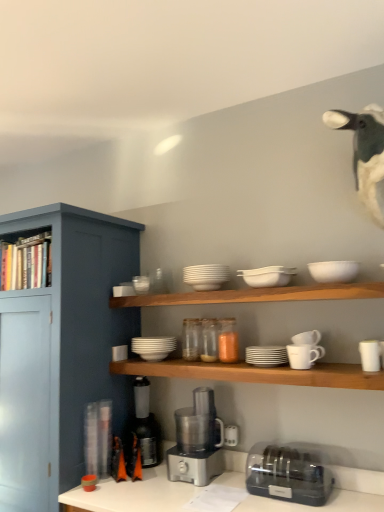
Question: From a real-world perspective, is metallic silver coffee machine at lower center, marked as the 1th coffee machine in a left-to-right arrangement, physically below satin silver food processor at center, the 1th coffee machine from the right?

Choices:
 (A) no
 (B) yes

Answer: (A)

Question: Can you confirm if metallic silver coffee machine at lower center, marked as the 1th coffee machine in a left-to-right arrangement, is taller than satin silver food processor at center, the 1th coffee machine from the right?

Choices:
 (A) yes
 (B) no

Answer: (A)

Question: Is metallic silver coffee machine at lower center, marked as the 1th coffee machine in a left-to-right arrangement, facing towards satin silver food processor at center, the 1th coffee machine from the right?

Choices:
 (A) yes
 (B) no

Answer: (B)

Question: Considering the relative positions of metallic silver coffee machine at lower center, marked as the 1th coffee machine in a left-to-right arrangement, and satin silver food processor at center, acting as the 2th coffee machine starting from the left, in the image provided, is metallic silver coffee machine at lower center, marked as the 1th coffee machine in a left-to-right arrangement, to the right of satin silver food processor at center, acting as the 2th coffee machine starting from the left, from the viewer's perspective?

Choices:
 (A) no
 (B) yes

Answer: (A)

Question: From a real-world perspective, is metallic silver coffee machine at lower center, marked as the 1th coffee machine in a left-to-right arrangement, located higher than satin silver food processor at center, the 1th coffee machine from the right?

Choices:
 (A) no
 (B) yes

Answer: (B)

Question: Is metallic silver coffee machine at lower center, which is the second coffee machine in right-to-left order, positioned behind satin silver food processor at center, acting as the 2th coffee machine starting from the left?

Choices:
 (A) yes
 (B) no

Answer: (A)

Question: Would you say white matte plate at center, placed as the 3th tableware when sorted from left to right, is part of white matte mug at right, positioned as the 6th tableware in left-to-right order,'s contents?

Choices:
 (A) yes
 (B) no

Answer: (B)

Question: Considering the relative sizes of white matte mug at right, the 4th tableware from the right, and white matte plate at center, arranged as the 7th tableware when viewed from the right, in the image provided, is white matte mug at right, the 4th tableware from the right, bigger than white matte plate at center, arranged as the 7th tableware when viewed from the right,?

Choices:
 (A) no
 (B) yes

Answer: (A)

Question: Is white matte mug at right, the 4th tableware from the right, wider than white matte plate at center, arranged as the 7th tableware when viewed from the right?

Choices:
 (A) no
 (B) yes

Answer: (A)

Question: Is white matte mug at right, the 4th tableware from the right, smaller than white matte plate at center, arranged as the 7th tableware when viewed from the right?

Choices:
 (A) no
 (B) yes

Answer: (B)

Question: Is white matte mug at right, the 4th tableware from the right, shorter than white matte plate at center, arranged as the 7th tableware when viewed from the right?

Choices:
 (A) yes
 (B) no

Answer: (A)

Question: From a real-world perspective, is white matte mug at right, the 4th tableware from the right, beneath white matte plate at center, placed as the 3th tableware when sorted from left to right?

Choices:
 (A) yes
 (B) no

Answer: (A)

Question: Is white matte bowls at center, placed as the fourth tableware when sorted from left to right, closer to camera compared to white fabric duck at upper right?

Choices:
 (A) yes
 (B) no

Answer: (B)